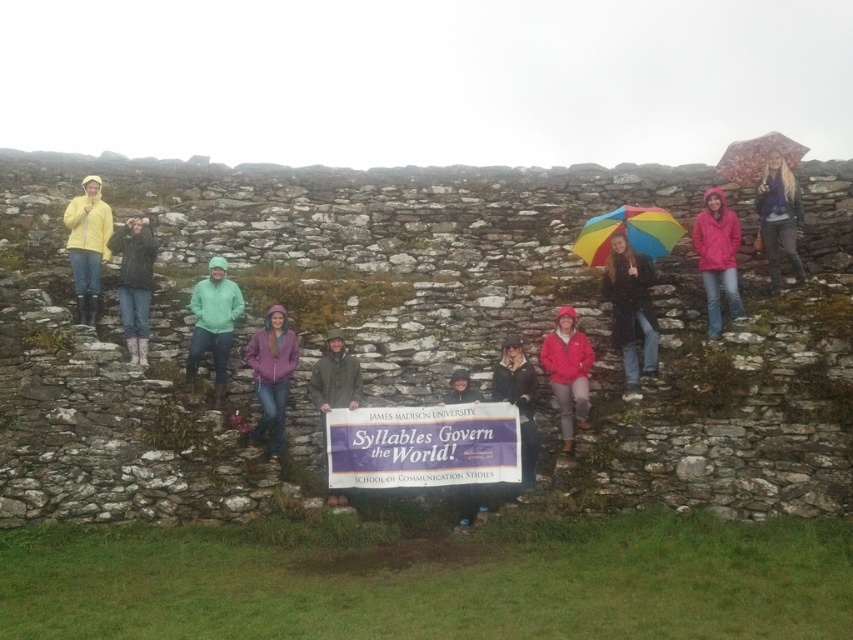
Question: Does green fleece jacket at center appear over matte purple jacket at upper right?

Choices:
 (A) no
 (B) yes

Answer: (A)

Question: Does green fleece jacket at center appear under purple fleece jacket at center?

Choices:
 (A) no
 (B) yes

Answer: (A)

Question: Which point appears farthest from the camera in this image?

Choices:
 (A) (664, 241)
 (B) (224, 310)
 (C) (622, 348)
 (D) (450, 419)

Answer: (A)

Question: Which point is closer to the camera?

Choices:
 (A) matte purple jacket at upper right
 (B) floral-patterned fabric umbrella at upper right

Answer: (A)

Question: Considering the relative positions of matte pink jacket at center and rainbow fabric umbrella at upper center in the image provided, where is matte pink jacket at center located with respect to rainbow fabric umbrella at upper center?

Choices:
 (A) right
 (B) left

Answer: (B)

Question: Which object is positioned farthest from the floral-patterned fabric umbrella at upper right?

Choices:
 (A) rainbow fabric umbrella at upper center
 (B) purple fleece jacket at center
 (C) matte black jacket at upper left
 (D) green fleece jacket at center

Answer: (C)